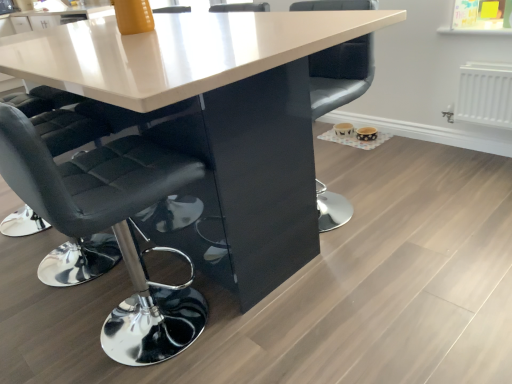
Locate an element on the screen. space that is in front of black leather chair at center, arranged as the first chair when viewed from the right is located at coordinates (364, 249).